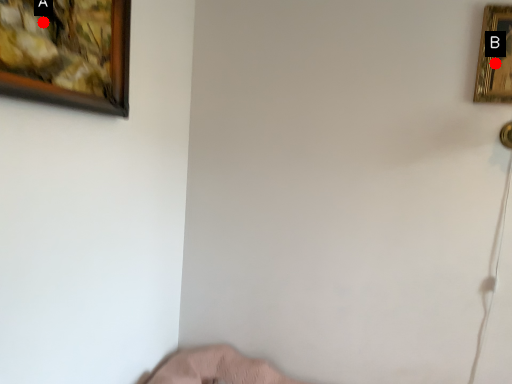
Question: Two points are circled on the image, labeled by A and B beside each circle. Which point appears closest to the camera in this image?

Choices:
 (A) A is closer
 (B) B is closer

Answer: (A)